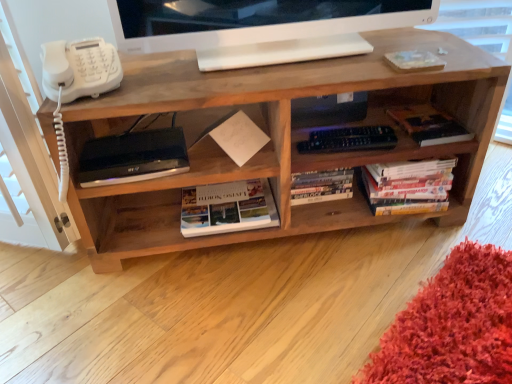
This screenshot has width=512, height=384. What do you see at coordinates (227, 208) in the screenshot? I see `white glossy book at center, arranged as the first book when viewed from the left` at bounding box center [227, 208].

Find the location of `satin black device at lower left`. satin black device at lower left is located at coordinates (133, 157).

Which is closer to the camera, (444, 164) or (359, 75)?

Point (444, 164) is positioned farther from the camera compared to point (359, 75).

In terms of height, does hardcover books at right, which is the second book from left to right, look taller or shorter compared to natural wood shelf at center?

Considering their sizes, hardcover books at right, which is the second book from left to right, has less height than natural wood shelf at center.

Is hardcover books at right, which is the second book from left to right, further to camera compared to natural wood shelf at center?

Yes, hardcover books at right, which is the second book from left to right, is further from the viewer.

Considering the positions of point (153, 212) and point (428, 131), is point (153, 212) closer or farther from the camera than point (428, 131)?

Point (153, 212).

Which is more to the left, natural wood shelf at center or hardcover book at center-right, the first book in the right-to-left sequence?

natural wood shelf at center is more to the left.

From the picture: From the image's perspective, is natural wood shelf at center beneath hardcover book at center-right, the first book in the right-to-left sequence?

Yes, from the image's perspective, natural wood shelf at center is beneath hardcover book at center-right, the first book in the right-to-left sequence.

Is white glossy monitor at upper center wider or thinner than white plastic phone at left?

Clearly, white glossy monitor at upper center has less width compared to white plastic phone at left.

Is white glossy monitor at upper center with white plastic phone at left?

No, white glossy monitor at upper center is not making contact with white plastic phone at left.

Which is more to the left, white plastic phone at left or satin black device at lower left?

From the viewer's perspective, white plastic phone at left appears more on the left side.

Is white plastic phone at left spatially inside satin black device at lower left, or outside of it?

white plastic phone at left exists outside the volume of satin black device at lower left.

Identify the location of corded phone in front of the satin black device at lower left. (79, 69).

Which is more distant, (105, 62) or (165, 168)?

The point (165, 168) is more distant.

Which is more to the right, white glossy book at center, arranged as the first book when viewed from the left, or white plastic phone at left?

white glossy book at center, arranged as the first book when viewed from the left.

There is a white glossy book at center, arranged as the first book when viewed from the left. Where is `corded phone above it (from a real-world perspective)`? The height and width of the screenshot is (384, 512). corded phone above it (from a real-world perspective) is located at coordinates (79, 69).

Could you tell me if white glossy book at center, arranged as the first book when viewed from the left, is turned towards white plastic phone at left?

No, white glossy book at center, arranged as the first book when viewed from the left, is not facing towards white plastic phone at left.

Considering the relative sizes of white glossy book at center, arranged as the first book when viewed from the left, and white plastic phone at left in the image provided, is white glossy book at center, arranged as the first book when viewed from the left, smaller than white plastic phone at left?

No.

Could you tell me if hardcover book at center-right, the first book in the right-to-left sequence, is facing hardcover books at right, the second book positioned from the right?

No, hardcover book at center-right, the first book in the right-to-left sequence, is not turned towards hardcover books at right, the second book positioned from the right.

From a real-world perspective, is hardcover book at center-right, the first book in the right-to-left sequence, physically above hardcover books at right, which is the second book from left to right?

Yes.

Which is more to the right, hardcover book at center-right, the first book in the right-to-left sequence, or hardcover books at right, the second book positioned from the right?

Positioned to the right is hardcover book at center-right, the first book in the right-to-left sequence.

Which of these two, satin black device at lower left or hardcover books at right, which is the second book from left to right, is bigger?

Bigger between the two is hardcover books at right, which is the second book from left to right.

Considering the sizes of objects satin black device at lower left and hardcover books at right, the second book positioned from the right, in the image provided, who is taller, satin black device at lower left or hardcover books at right, the second book positioned from the right,?

Standing taller between the two is hardcover books at right, the second book positioned from the right.

Is hardcover books at right, which is the second book from left to right, at the back of satin black device at lower left?

No, satin black device at lower left's orientation is not away from hardcover books at right, which is the second book from left to right.

Could you measure the distance between satin black device at lower left and hardcover books at right, the second book positioned from the right?

satin black device at lower left and hardcover books at right, the second book positioned from the right, are 22.20 inches apart from each other.

The width and height of the screenshot is (512, 384). In order to click on shelf lying in front of the hardcover books at right, the second book positioned from the right in this screenshot , I will do `click(273, 138)`.

Locate an element on the screen. Image resolution: width=512 pixels, height=384 pixels. shelf beneath the hardcover book at center-right, the first book in the right-to-left sequence (from a real-world perspective) is located at coordinates [273, 138].

Which object lies nearer to the anchor point white glossy monitor at upper center, hardcover book at center-right, the first book in the right-to-left sequence, or hardcover books at right, the second book positioned from the right?

hardcover book at center-right, the first book in the right-to-left sequence, is closer to white glossy monitor at upper center.

Estimate the real-world distances between objects in this image. Which object is further from white glossy monitor at upper center, hardcover books at right, which is the second book from left to right, or satin black device at lower left?

hardcover books at right, which is the second book from left to right, is further to white glossy monitor at upper center.

Looking at the image, which one is located closer to satin black device at lower left, hardcover book at center-right, which is counted as the 3th book, starting from the left, or white glossy book at center, which appears as the 3th book when viewed from the right?

white glossy book at center, which appears as the 3th book when viewed from the right, lies closer to satin black device at lower left than the other object.

Looking at the image, which one is located further to white glossy book at center, arranged as the first book when viewed from the left, natural wood shelf at center or hardcover book at center-right, which is counted as the 3th book, starting from the left?

hardcover book at center-right, which is counted as the 3th book, starting from the left.

Estimate the real-world distances between objects in this image. Which object is further from white plastic phone at left, hardcover books at right, the second book positioned from the right, or hardcover book at center-right, which is counted as the 3th book, starting from the left?

hardcover book at center-right, which is counted as the 3th book, starting from the left, lies further to white plastic phone at left than the other object.

Based on the photo, considering their positions, is satin black device at lower left positioned closer to white plastic phone at left than natural wood shelf at center?

satin black device at lower left lies closer to white plastic phone at left than the other object.

Estimate the real-world distances between objects in this image. Which object is further from hardcover book at center-right, which is counted as the 3th book, starting from the left, white glossy book at center, which appears as the 3th book when viewed from the right, or white glossy monitor at upper center?

white glossy book at center, which appears as the 3th book when viewed from the right.

When comparing their distances from natural wood shelf at center, does white glossy monitor at upper center or satin black device at lower left seem closer?

The object closer to natural wood shelf at center is white glossy monitor at upper center.

Identify the location of shelf between white glossy monitor at upper center and white glossy book at center, arranged as the first book when viewed from the left, from top to bottom. Image resolution: width=512 pixels, height=384 pixels. (273, 138).

The height and width of the screenshot is (384, 512). Find the location of `television located between satin black device at lower left and hardcover books at right, which is the second book from left to right, in the left-right direction`. television located between satin black device at lower left and hardcover books at right, which is the second book from left to right, in the left-right direction is located at coordinates (253, 20).

Locate an element on the screen. book located between satin black device at lower left and hardcover books at right, the second book positioned from the right, in the left-right direction is located at coordinates (227, 208).

At what (x,y) coordinates should I click in order to perform the action: click on book located between white plastic phone at left and hardcover books at right, the second book positioned from the right, in the left-right direction. Please return your answer as a coordinate pair (x, y). This screenshot has width=512, height=384. Looking at the image, I should click on (227, 208).